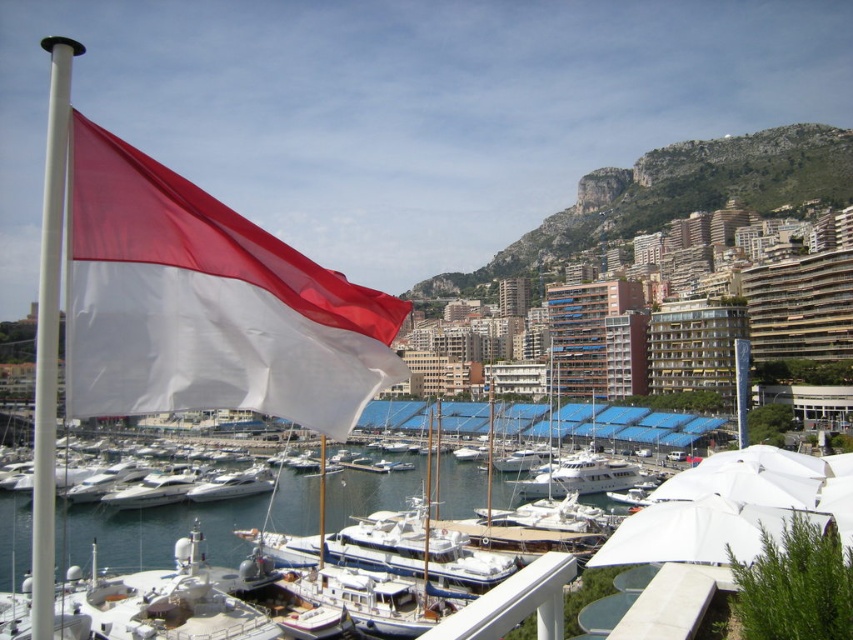
You are standing at the edge of the marina and want to take a photo that includes both the red and white flag and the boats. If you focus your camera on point 1 at point (x=91, y=138), will point 2 at point (x=236, y=490) be in focus as well?

Point 1 at point (x=91, y=138) is closer to the camera than point 2 at point (x=236, y=490). Depending on the camera focus settings, if the depth of field is sufficient to cover both distances, then both points might be in focus. However, if the focus is set only on point 1, point 2 might be slightly out of focus due to its greater distance from the camera.